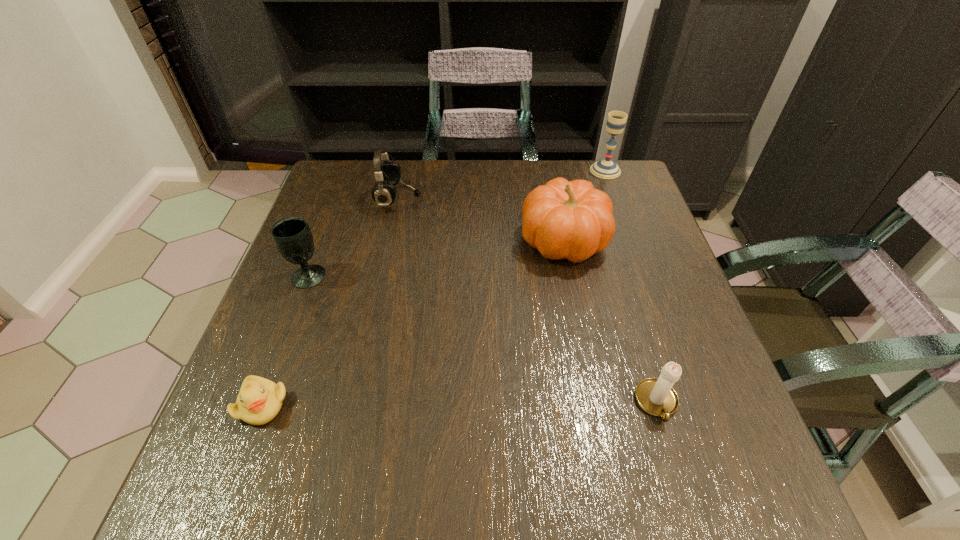
Image resolution: width=960 pixels, height=540 pixels. I want to click on vacant space in between the right chalice and the candle holder, so click(631, 287).

Identify the location of vacant space in between the headset and the farther chalice. Image resolution: width=960 pixels, height=540 pixels. (502, 184).

Find the location of a particular element. vacant space that is in between the third object from left to right and the shortest object is located at coordinates (330, 301).

I want to click on vacant area that lies between the fifth tallest object and the nearer chalice, so click(x=483, y=339).

Locate an element on the screen. empty space between the fifth tallest object and the shorter chalice is located at coordinates (483, 339).

Where is `free space between the headset and the pumpkin`? This screenshot has height=540, width=960. free space between the headset and the pumpkin is located at coordinates (481, 219).

The height and width of the screenshot is (540, 960). Find the location of `free space between the third object from left to right and the farthest object`. free space between the third object from left to right and the farthest object is located at coordinates (502, 184).

Image resolution: width=960 pixels, height=540 pixels. I want to click on empty location between the pumpkin and the shortest object, so click(413, 322).

Where is `unoccupied position between the right chalice and the duckling`? unoccupied position between the right chalice and the duckling is located at coordinates (434, 288).

You are a GUI agent. You are given a task and a screenshot of the screen. Output one action in this format:
    pyautogui.click(x=<x>, y=<y>)
    Task: Click on the free spot between the fifth tallest object and the pumpkin
    The width and height of the screenshot is (960, 540).
    Given the screenshot: What is the action you would take?
    pyautogui.click(x=611, y=322)